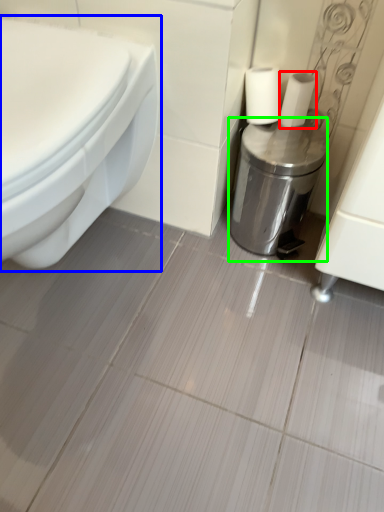
Question: Estimate the real-world distances between objects in this image. Which object is farther from toilet paper (highlighted by a red box), toilet (highlighted by a blue box) or dispenser (highlighted by a green box)?

Choices:
 (A) toilet
 (B) dispenser

Answer: (A)